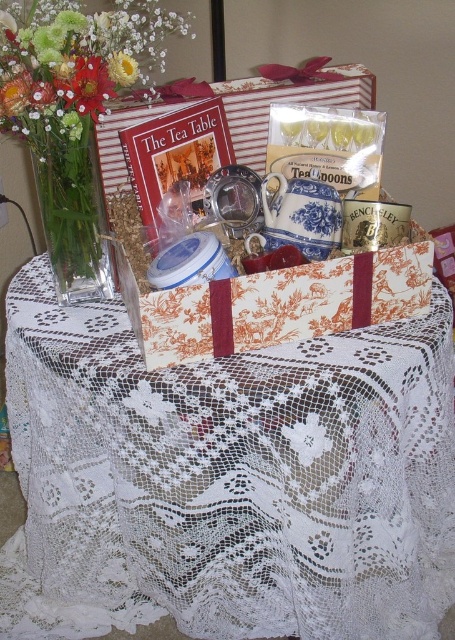
You are placing a small vase on the table. The vase is exactly the same width as the yellow fabric flower at upper left. Will it fit on the white lace tablecloth at center without overlapping the edge?

The white lace tablecloth at center might be wider than yellow fabric flower at upper left, so the vase, which is the same width as the yellow fabric flower at upper left, should fit on the tablecloth without overlapping the edge if the tablecloth is indeed wider. However, the exact width isn

You are standing at the front of the gift basket and want to reach both points. Which point should you reach first, point (173, 26) or point (110, 68)?

You should reach point (110, 68) first because it is in front of point (173, 26).